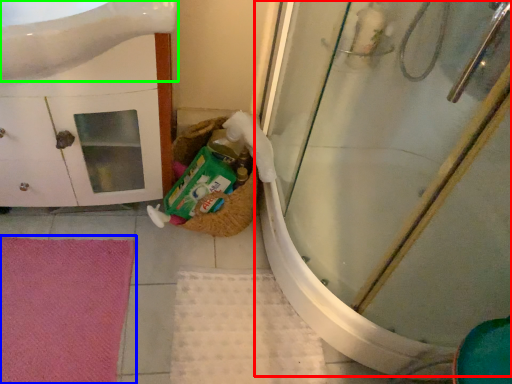
Question: Which object is the farthest from shower door (highlighted by a red box)? Choose among these: bath mat (highlighted by a blue box) or sink (highlighted by a green box).

Choices:
 (A) bath mat
 (B) sink

Answer: (A)